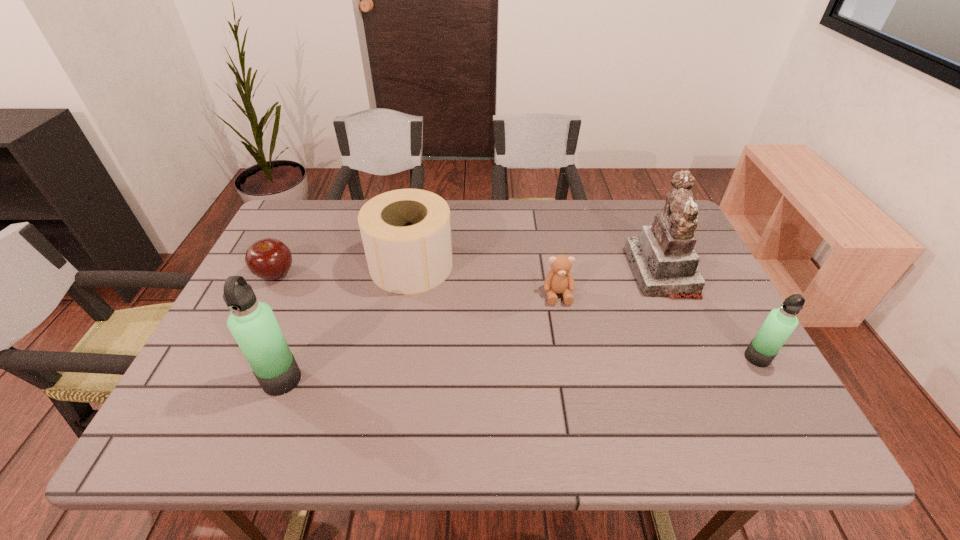
Where is `the left thermos bottle`? This screenshot has width=960, height=540. the left thermos bottle is located at coordinates (253, 324).

What are the coordinates of `the second object from left to right` in the screenshot? It's located at (253, 324).

You are a GUI agent. You are given a task and a screenshot of the screen. Output one action in this format:
    pyautogui.click(x=<x>, y=<y>)
    Task: Click on the rightmost object
    The width and height of the screenshot is (960, 540).
    Given the screenshot: What is the action you would take?
    pyautogui.click(x=780, y=323)

Where is `the shorter thermos bottle`? This screenshot has height=540, width=960. the shorter thermos bottle is located at coordinates (780, 323).

This screenshot has height=540, width=960. I want to click on the third object from left to right, so click(406, 233).

Locate an element on the screen. The image size is (960, 540). teddy bear is located at coordinates (559, 280).

Find the location of a particular element. The image size is (960, 540). the second object from right to left is located at coordinates (x=663, y=259).

This screenshot has height=540, width=960. Find the location of `apple`. apple is located at coordinates (270, 259).

This screenshot has width=960, height=540. Identify the location of vacant space located 0.220m on the right of the fifth object from right to left. (401, 380).

At what (x,y) coordinates should I click in order to perform the action: click on vacant space positioned on the left of the right thermos bottle. Please return your answer as a coordinate pair (x, y). The image size is (960, 540). Looking at the image, I should click on (658, 357).